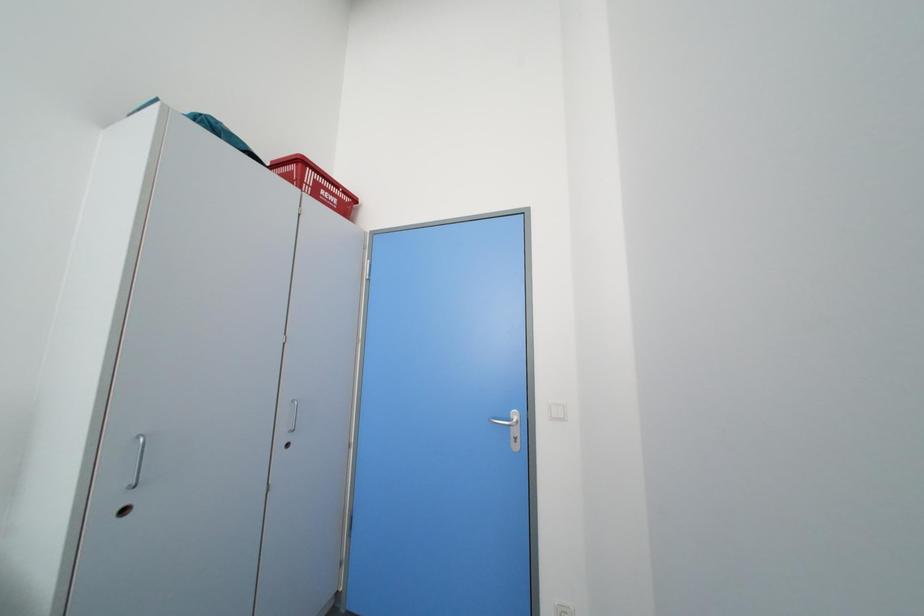
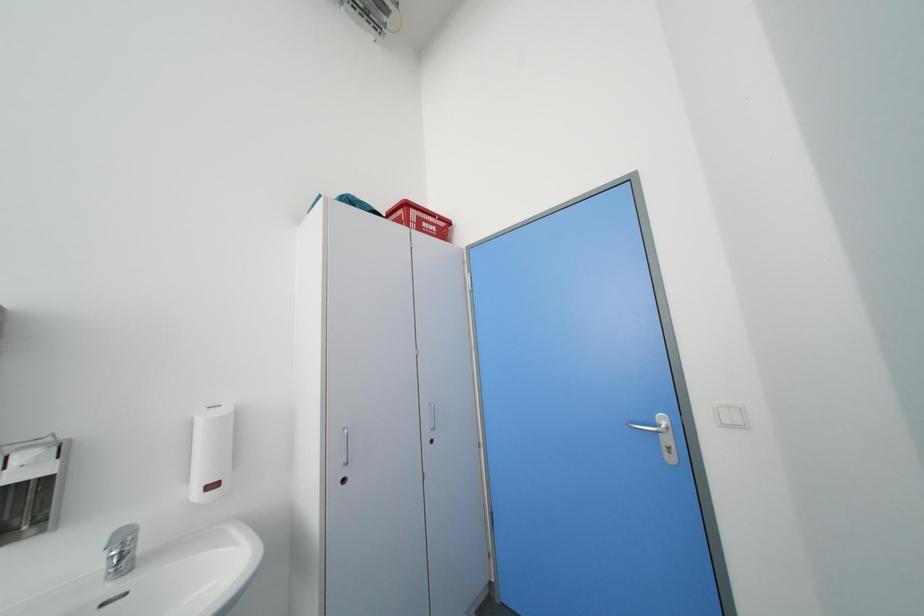
What movement of the cameraman would produce the second image?

The cameraman walked toward left, backward.